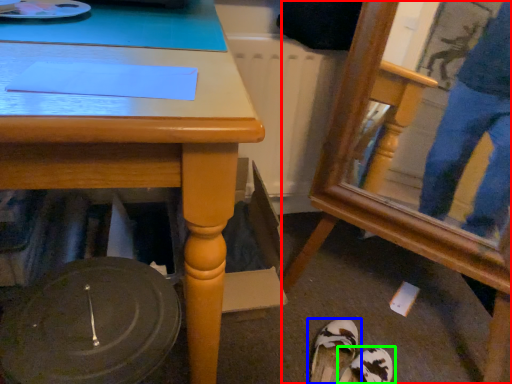
Question: Based on their relative distances, which object is nearer to swivel chair (highlighted by a red box)? Choose from footwear (highlighted by a blue box) and footwear (highlighted by a green box).

Choices:
 (A) footwear
 (B) footwear

Answer: (A)